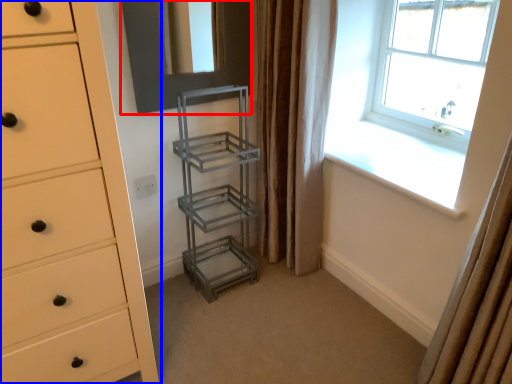
Question: Among these objects, which one is farthest to the camera, screen door (highlighted by a red box) or chest of drawers (highlighted by a blue box)?

Choices:
 (A) screen door
 (B) chest of drawers

Answer: (A)